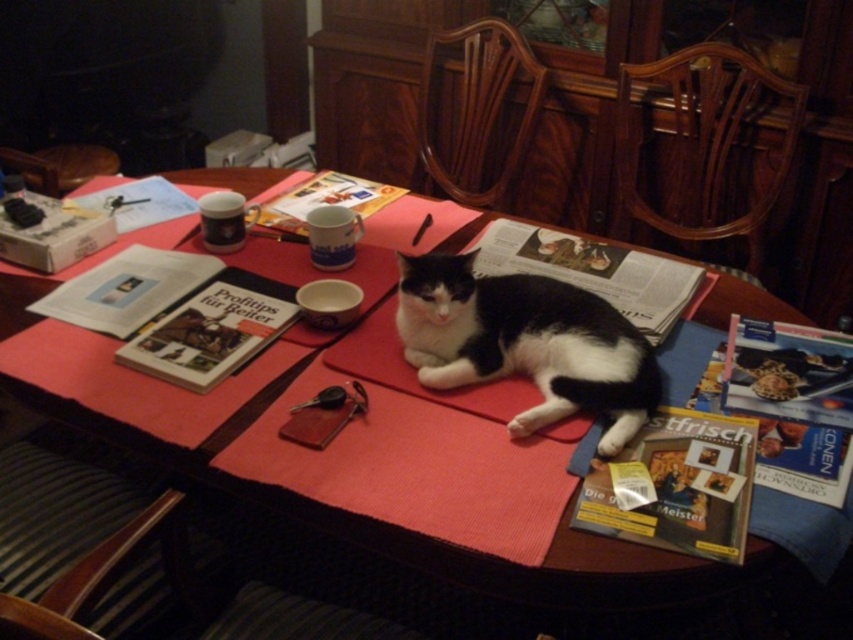
Who is more forward, [422,624] or [554,301]?

Point [554,301] is in front.

Which is behind, point (410, 509) or point (570, 285)?

Point (570, 285)

The height and width of the screenshot is (640, 853). Find the location of `smooth wooden table at center`. smooth wooden table at center is located at coordinates (363, 497).